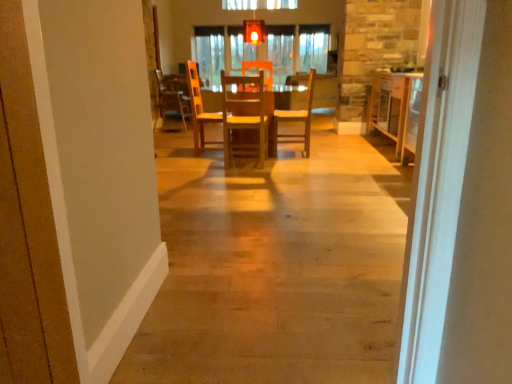
Question: Relative to matte glass light fixture at upper center, is wooden table at center, marked as the 1th table in a right-to-left arrangement, in front or behind?

Choices:
 (A) behind
 (B) front

Answer: (B)

Question: From the image's perspective, is wooden table at center, which is the 2th table from left to right, located above or below matte glass light fixture at upper center?

Choices:
 (A) above
 (B) below

Answer: (B)

Question: Which of these objects is positioned farthest from the matte glass light fixture at upper center?

Choices:
 (A) wooden chair at center, which ranks as the third chair in back-to-front order
 (B) wooden table at center, marked as the 1th table in a right-to-left arrangement
 (C) wooden chair at center, the 3th chair in the front-to-back sequence
 (D) wooden table at center, the second table when ordered from right to left
 (E) wooden chair at center, which ranks as the 2th chair in back-to-front order

Answer: (B)

Question: Considering the real-world distances, which object is closest to the matte glass light fixture at upper center?

Choices:
 (A) wooden chair at center, the third chair when ordered from left to right
 (B) wooden table at center, which is the 2th table from left to right
 (C) wooden chair at center, the first chair in the back-to-front sequence
 (D) wooden floor at center
 (E) wooden chair at center, marked as the second chair in a left-to-right arrangement

Answer: (E)